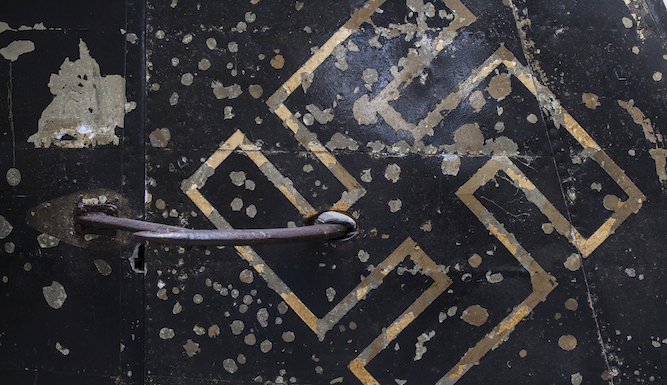
At what (x,y) coordinates should I click in order to perform the action: click on hole in door frame. Please return your answer as a coordinate pair (x, y). This screenshot has width=667, height=385. Looking at the image, I should click on (139, 261).